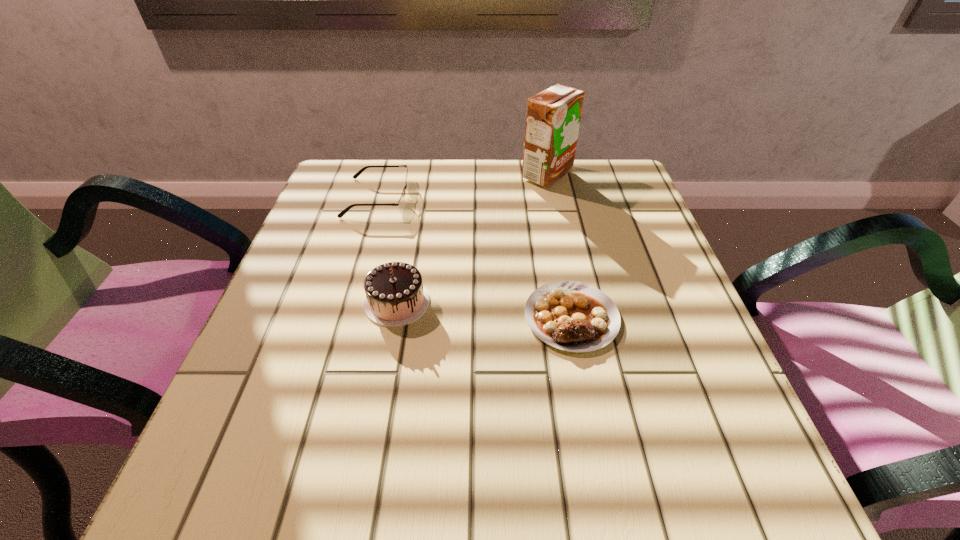
You are a GUI agent. You are given a task and a screenshot of the screen. Output one action in this format:
    pyautogui.click(x=<x>, y=<y>)
    Task: Click on the vacant space at the far left corner of the desktop
    
    Given the screenshot: What is the action you would take?
    pyautogui.click(x=361, y=179)

Identify the location of vacant area at the far right corner of the desktop. [x=630, y=199].

Find the location of a particular element. free point at the near right corner is located at coordinates (725, 506).

The height and width of the screenshot is (540, 960). Find the location of `empty location between the shortest object and the spectacles`. empty location between the shortest object and the spectacles is located at coordinates (474, 258).

Locate an element on the screen. The height and width of the screenshot is (540, 960). empty space between the second shortest object and the chocolate cake is located at coordinates (387, 250).

This screenshot has width=960, height=540. In order to click on unoccupied area between the steak and the spectacles in this screenshot , I will do `click(474, 258)`.

Where is `unoccupied area between the spectacles and the tallest object`? unoccupied area between the spectacles and the tallest object is located at coordinates (463, 186).

You are a GUI agent. You are given a task and a screenshot of the screen. Output one action in this format:
    pyautogui.click(x=<x>, y=<y>)
    Task: Click on the free area in between the steak and the second tallest object
    This screenshot has width=960, height=540.
    Given the screenshot: What is the action you would take?
    pyautogui.click(x=484, y=309)

This screenshot has width=960, height=540. I want to click on free space between the second tallest object and the carton, so click(x=472, y=239).

Locate an element on the screen. The width and height of the screenshot is (960, 540). unoccupied position between the second shortest object and the steak is located at coordinates (474, 258).